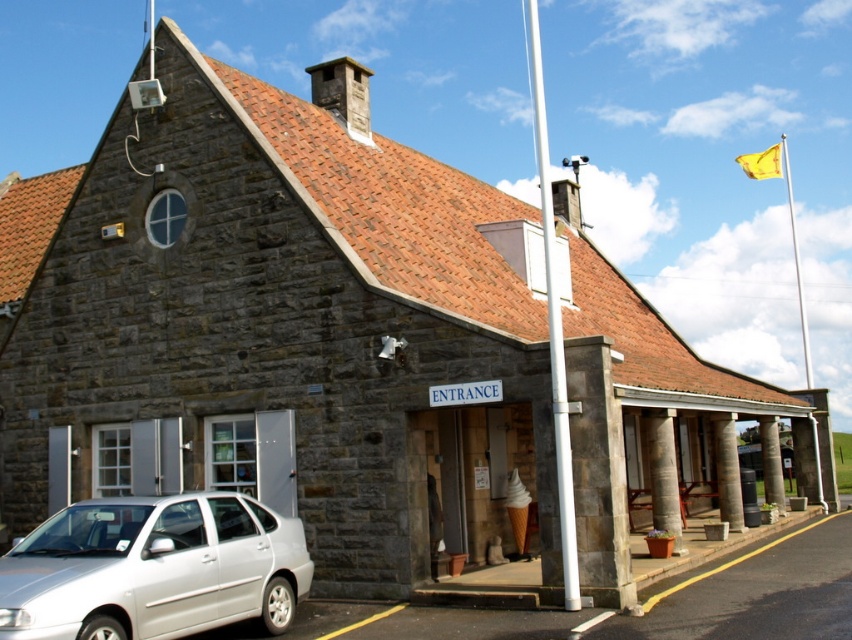
Is yellow fabric flagpole at upper right to the left of brown stone pillar at lower right from the viewer's perspective?

No, yellow fabric flagpole at upper right is not to the left of brown stone pillar at lower right.

Describe the element at coordinates (797, 268) in the screenshot. This screenshot has height=640, width=852. I see `yellow fabric flagpole at upper right` at that location.

The width and height of the screenshot is (852, 640). I want to click on yellow fabric flagpole at upper right, so coord(797,268).

Who is more distant from viewer, (124, 579) or (770, 490)?

Point (770, 490)

Does silver metallic car at lower left appear on the left side of brown stone pillar at lower right?

Yes, silver metallic car at lower left is to the left of brown stone pillar at lower right.

Describe the element at coordinates (153, 568) in the screenshot. Image resolution: width=852 pixels, height=640 pixels. I see `silver metallic car at lower left` at that location.

Identify the location of silver metallic car at lower left. Image resolution: width=852 pixels, height=640 pixels. (153, 568).

Between point (727, 445) and point (770, 435), which one is positioned in front?

Point (727, 445) is more forward.

What do you see at coordinates (727, 470) in the screenshot? I see `smooth stone column at center` at bounding box center [727, 470].

What are the coordinates of `smooth stone column at center` in the screenshot? It's located at (727, 470).